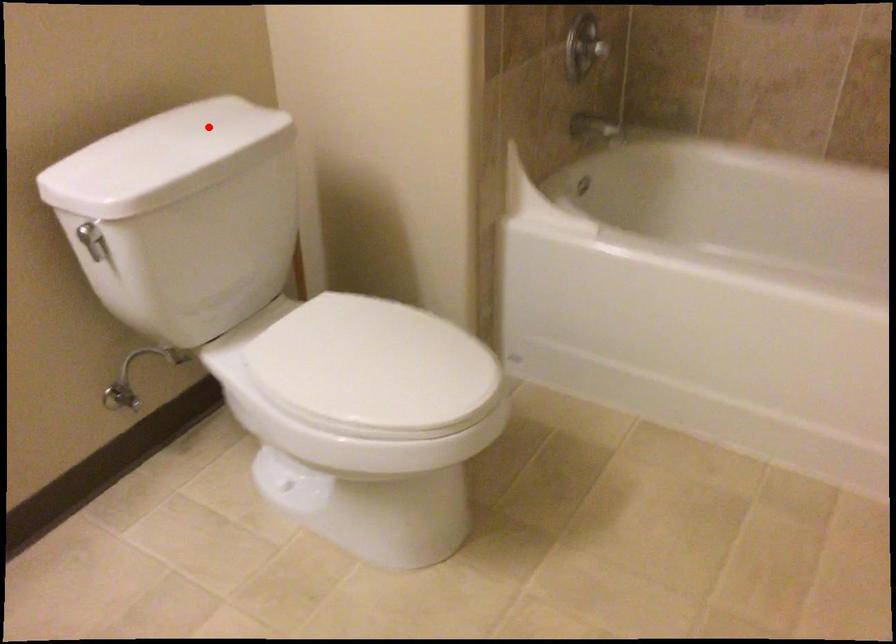
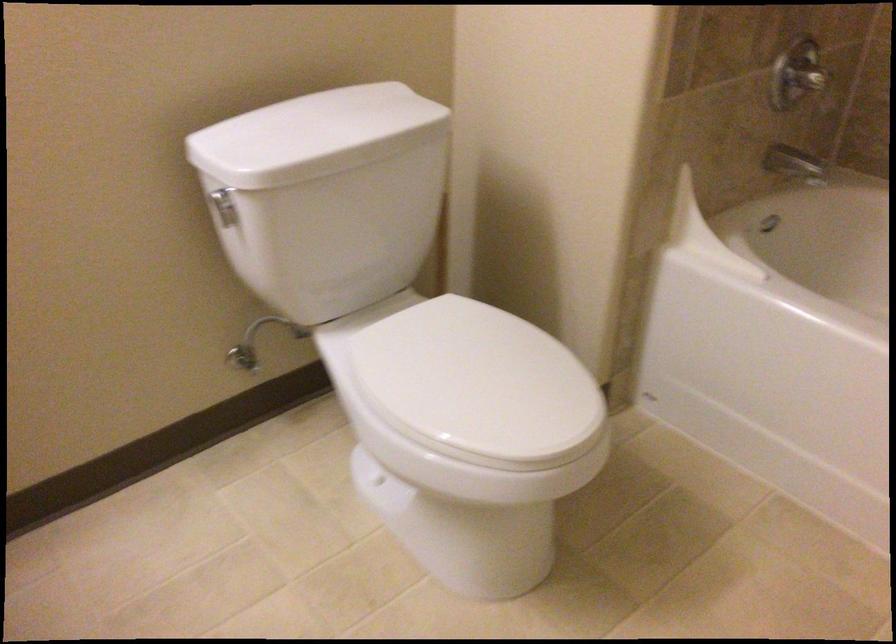
The point at the highlighted location is marked in the first image. Where is the corresponding point in the second image?

(366, 109)